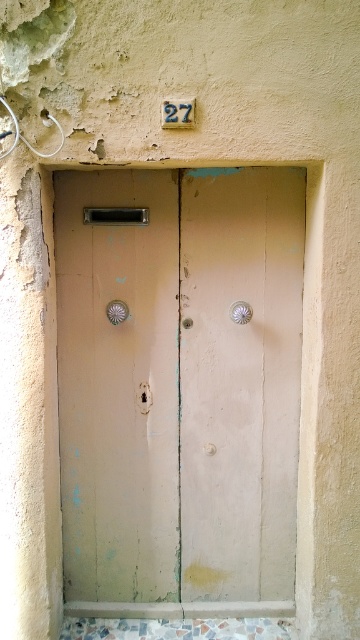
Does matte silver door handle at center have a greater height compared to satin silver door handle at center?

Incorrect, matte silver door handle at center's height is not larger of satin silver door handle at center's.

Can you confirm if matte silver door handle at center is thinner than satin silver door handle at center?

In fact, matte silver door handle at center might be wider than satin silver door handle at center.

Is point (102, 212) farther from camera compared to point (240, 321)?

Yes.

Identify the location of matte silver door handle at center. This screenshot has width=360, height=640. (115, 216).

Based on the photo, is matte pink wood door at center shorter than matte silver door handle at center?

In fact, matte pink wood door at center may be taller than matte silver door handle at center.

Between matte pink wood door at center and matte silver door handle at center, which one appears on the right side from the viewer's perspective?

matte pink wood door at center is more to the right.

Does point (190, 499) come behind point (114, 218)?

Yes, point (190, 499) is farther from viewer.

This screenshot has height=640, width=360. I want to click on matte pink wood door at center, so click(180, 385).

Consider the image. Can you confirm if metallic silver door handle at center is positioned to the left of satin silver door handle at center?

Correct, you'll find metallic silver door handle at center to the left of satin silver door handle at center.

Does metallic silver door handle at center have a lesser width compared to satin silver door handle at center?

Yes.

Is point (110, 314) farther from viewer compared to point (244, 320)?

Yes, point (110, 314) is farther from viewer.

In order to click on metallic silver door handle at center in this screenshot , I will do `click(117, 310)`.